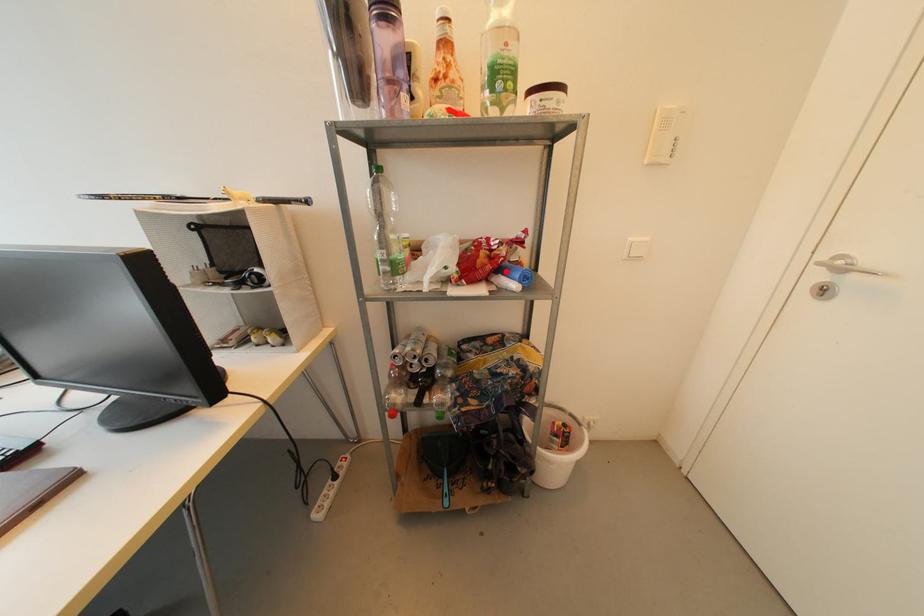
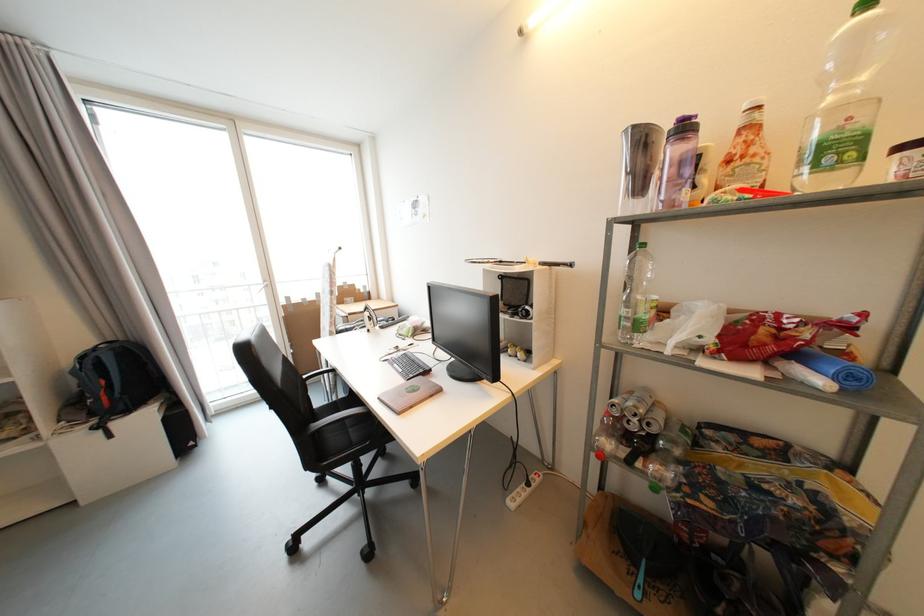
The point at the highlighted location is marked in the first image. Where is the corresponding point in the second image?

(801, 357)